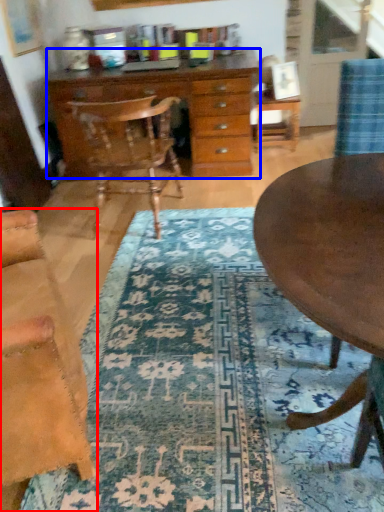
Question: Which of the following is the farthest to the observer, chair (highlighted by a red box) or chest of drawers (highlighted by a blue box)?

Choices:
 (A) chair
 (B) chest of drawers

Answer: (B)